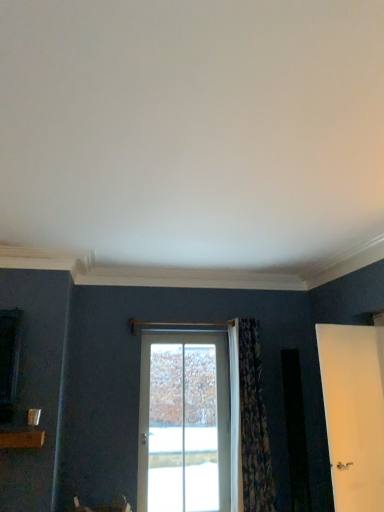
The width and height of the screenshot is (384, 512). Describe the element at coordinates (254, 423) in the screenshot. I see `patterned fabric curtain at center` at that location.

The image size is (384, 512). Describe the element at coordinates (354, 413) in the screenshot. I see `white matte door at right, which is the second door from left to right` at that location.

I want to click on white glass door at center, placed as the second door when sorted from front to back, so click(188, 422).

How many degrees apart are the facing directions of white glass door at center, placed as the second door when sorted from front to back, and patterned fabric curtain at center?

The angular difference between white glass door at center, placed as the second door when sorted from front to back, and patterned fabric curtain at center is 0.971 degrees.

Is the position of white glass door at center, placed as the second door when sorted from front to back, more distant than that of patterned fabric curtain at center?

Yes, the depth of white glass door at center, placed as the second door when sorted from front to back, is greater than that of patterned fabric curtain at center.

Can you confirm if white glass door at center, placed as the second door when sorted from front to back, is smaller than patterned fabric curtain at center?

Correct, white glass door at center, placed as the second door when sorted from front to back, occupies less space than patterned fabric curtain at center.

Does white glass door at center, placed as the second door when sorted from front to back, have a greater width compared to patterned fabric curtain at center?

No, white glass door at center, placed as the second door when sorted from front to back, is not wider than patterned fabric curtain at center.

Where is `door above the patterned fabric curtain at center (from the image's perspective)`? door above the patterned fabric curtain at center (from the image's perspective) is located at coordinates click(x=354, y=413).

Can you confirm if patterned fabric curtain at center is thinner than white matte door at right, arranged as the 2th door when viewed from the back?

Incorrect, the width of patterned fabric curtain at center is not less than that of white matte door at right, arranged as the 2th door when viewed from the back.

Which is more to the left, patterned fabric curtain at center or white matte door at right, which is the 1th door from front to back?

patterned fabric curtain at center is more to the left.

Are patterned fabric curtain at center and white matte door at right, the 1th door from the right, located far from each other?

Absolutely, patterned fabric curtain at center is distant from white matte door at right, the 1th door from the right.

Is patterned fabric curtain at center facing away from white glass door at center, the second door positioned from the right?

No, patterned fabric curtain at center's orientation is not away from white glass door at center, the second door positioned from the right.

From a real-world perspective, between patterned fabric curtain at center and white glass door at center, acting as the first door starting from the left, who is vertically lower?

white glass door at center, acting as the first door starting from the left.

Can we say patterned fabric curtain at center lies outside white glass door at center, which is the first door in back-to-front order?

Absolutely, patterned fabric curtain at center is external to white glass door at center, which is the first door in back-to-front order.

From the image's perspective, is patterned fabric curtain at center above white glass door at center, which is the first door in back-to-front order?

Yes.

Which object is closer to the camera, white matte door at right, which is the second door from left to right, or patterned fabric curtain at center?

white matte door at right, which is the second door from left to right, is closer to the camera.

You are a GUI agent. You are given a task and a screenshot of the screen. Output one action in this format:
    pyautogui.click(x=<x>, y=<y>)
    Task: Click on the curtain on the left of white matte door at right, arranged as the 2th door when viewed from the back
    
    Given the screenshot: What is the action you would take?
    pyautogui.click(x=254, y=423)

Looking at this image, which is more to the right, white matte door at right, which is the 1th door from front to back, or patterned fabric curtain at center?

white matte door at right, which is the 1th door from front to back.

Looking at this image, how much distance is there between white matte door at right, which is the second door from left to right, and patterned fabric curtain at center?

A distance of 3.48 feet exists between white matte door at right, which is the second door from left to right, and patterned fabric curtain at center.

Which object is positioned more to the left, white glass door at center, which is the first door in back-to-front order, or white matte door at right, which is the 1th door from front to back?

From the viewer's perspective, white glass door at center, which is the first door in back-to-front order, appears more on the left side.

Which of these two, white glass door at center, acting as the first door starting from the left, or white matte door at right, arranged as the 2th door when viewed from the back, is thinner?

white matte door at right, arranged as the 2th door when viewed from the back.

Relative to white matte door at right, which is the second door from left to right, is white glass door at center, acting as the first door starting from the left, in front or behind?

white glass door at center, acting as the first door starting from the left, is behind white matte door at right, which is the second door from left to right.

Which of these two, white glass door at center, acting as the first door starting from the left, or white matte door at right, the 1th door from the right, is smaller?

white matte door at right, the 1th door from the right, is smaller.

Does white matte door at right, the 1th door from the right, have a lesser width compared to white glass door at center, which is the first door in back-to-front order?

Yes.

Is white matte door at right, arranged as the 2th door when viewed from the back, far from white glass door at center, the second door positioned from the right?

Yes.

Choose the correct answer: Is white matte door at right, the 1th door from the right, inside white glass door at center, placed as the second door when sorted from front to back, or outside it?

white matte door at right, the 1th door from the right, is not inside white glass door at center, placed as the second door when sorted from front to back, it's outside.

Where is `door behind the patterned fabric curtain at center`? The image size is (384, 512). door behind the patterned fabric curtain at center is located at coordinates pos(188,422).

Locate an element on the screen. This screenshot has height=512, width=384. curtain directly beneath the white matte door at right, arranged as the 2th door when viewed from the back (from a real-world perspective) is located at coordinates (254, 423).

Consider the image. Which object lies nearer to the anchor point patterned fabric curtain at center, white glass door at center, which is the first door in back-to-front order, or white matte door at right, which is the second door from left to right?

white glass door at center, which is the first door in back-to-front order, lies closer to patterned fabric curtain at center than the other object.

Which object lies further to the anchor point white matte door at right, the 1th door from the right, white glass door at center, which is the first door in back-to-front order, or patterned fabric curtain at center?

Based on the image, white glass door at center, which is the first door in back-to-front order, appears to be further to white matte door at right, the 1th door from the right.

Which object lies nearer to the anchor point white glass door at center, which is the first door in back-to-front order, patterned fabric curtain at center or white matte door at right, which is the 1th door from front to back?

Based on the image, patterned fabric curtain at center appears to be nearer to white glass door at center, which is the first door in back-to-front order.

From the image, which object appears to be farther from patterned fabric curtain at center, white matte door at right, arranged as the 2th door when viewed from the back, or white glass door at center, acting as the first door starting from the left?

white matte door at right, arranged as the 2th door when viewed from the back, lies further to patterned fabric curtain at center than the other object.

Considering their positions, is patterned fabric curtain at center positioned further to white matte door at right, which is the 1th door from front to back, than white glass door at center, acting as the first door starting from the left?

The object further to white matte door at right, which is the 1th door from front to back, is white glass door at center, acting as the first door starting from the left.

From the image, which object appears to be nearer to white glass door at center, placed as the second door when sorted from front to back, white matte door at right, the 1th door from the right, or patterned fabric curtain at center?

patterned fabric curtain at center is positioned closer to the anchor white glass door at center, placed as the second door when sorted from front to back.

Find the location of a particular element. The height and width of the screenshot is (512, 384). curtain located between white glass door at center, acting as the first door starting from the left, and white matte door at right, the 1th door from the right, in the left-right direction is located at coordinates (254, 423).